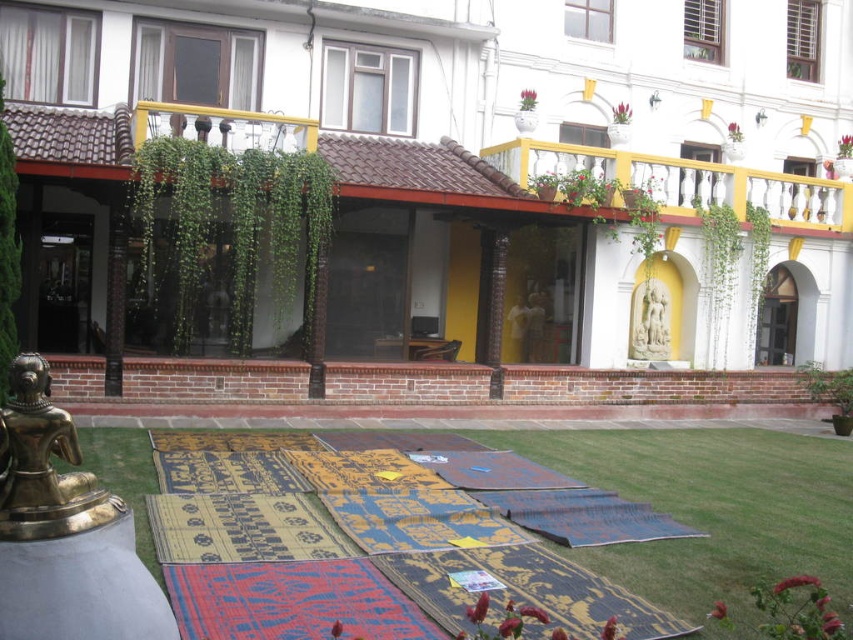
You are a visitor standing in the courtyard and want to take a photo that includes both the brass statue at lower left and the white stone statue at center. Given that your camera can capture a maximum distance of 12 meters between objects in focus, will you be able to capture both statues clearly in the same photo?

The brass statue at lower left and the white stone statue at center are 12.51 meters apart, which exceeds the camera maximum distance of 12 meters, so you cannot capture both clearly in the same photo.

You are a customer at a courtyard market and see the textured woolen mat at lower center and the white stone statue at center. Which item takes up more space on the ground?

The textured woolen mat at lower center takes up more space on the ground because it has a larger size compared to the white stone statue at center.